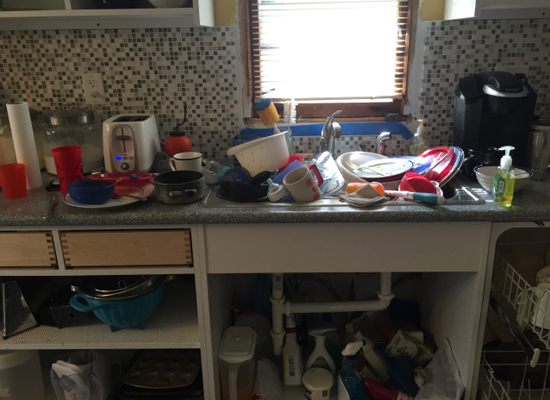
Identify the location of countertop. Image resolution: width=550 pixels, height=400 pixels. (137, 215).